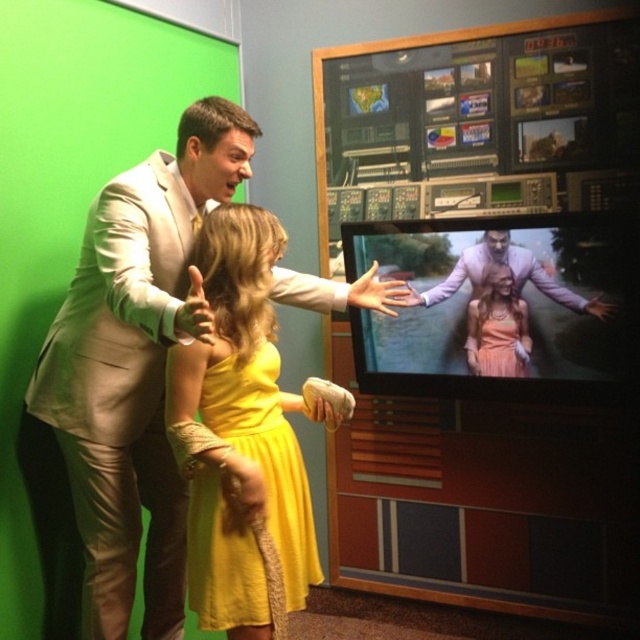
Question: Is satin silver suit at upper left smaller than pink satin dress at center?

Choices:
 (A) no
 (B) yes

Answer: (A)

Question: Which point appears closest to the camera in this image?

Choices:
 (A) (432, 298)
 (B) (218, 570)
 (C) (516, 314)
 (D) (241, 131)

Answer: (B)

Question: In this image, where is satin silver suit at upper left located relative to yellow satin dress at center?

Choices:
 (A) left
 (B) right

Answer: (A)

Question: Which point appears closest to the camera in this image?

Choices:
 (A) (506, 317)
 (B) (477, 284)
 (C) (202, 573)

Answer: (C)

Question: Considering the real-world distances, which object is closest to the matte purple suit at center?

Choices:
 (A) yellow satin dress at center
 (B) pink satin dress at center
 (C) satin silver suit at upper left

Answer: (B)

Question: Is yellow satin dress at center below pink satin dress at center?

Choices:
 (A) yes
 (B) no

Answer: (A)